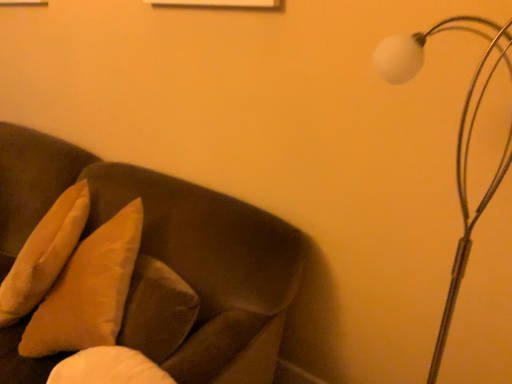
This screenshot has width=512, height=384. Describe the element at coordinates (44, 254) in the screenshot. I see `soft beige pillow at left` at that location.

Where is `soft beige pillow at left`? This screenshot has width=512, height=384. soft beige pillow at left is located at coordinates (44, 254).

Describe the element at coordinates (164, 241) in the screenshot. The image size is (512, 384). I see `suede-like brown couch at left` at that location.

I want to click on soft beige pillow at left, so click(44, 254).

Is suede-like brown couch at left looking in the opposite direction of soft beige pillow at left?

Absolutely, suede-like brown couch at left is directed away from soft beige pillow at left.

Which of these two, suede-like brown couch at left or soft beige pillow at left, is wider?

suede-like brown couch at left.

From a real-world perspective, between suede-like brown couch at left and soft beige pillow at left, who is vertically lower?

suede-like brown couch at left, from a real-world perspective.

Which is correct: suede-like brown couch at left is inside soft beige pillow at left, or outside of it?

suede-like brown couch at left is spatially situated outside soft beige pillow at left.

Looking at this image, would you say suede-like brown couch at left contains white matte lamp at upper right?

No.

From the image's perspective, which one is positioned lower, suede-like brown couch at left or white matte lamp at upper right?

suede-like brown couch at left is shown below in the image.

Who is shorter, suede-like brown couch at left or white matte lamp at upper right?

suede-like brown couch at left.

Is suede-like brown couch at left touching white matte lamp at upper right?

suede-like brown couch at left and white matte lamp at upper right are not in contact.

In the scene shown: Is soft beige pillow at left in front of or behind white matte lamp at upper right in the image?

soft beige pillow at left is positioned farther from the viewer than white matte lamp at upper right.

Does point (81, 229) lie behind point (463, 268)?

That is True.

In the scene shown: Is soft beige pillow at left not within white matte lamp at upper right?

Yes.

Which object is positioned more to the left, soft beige pillow at left or white matte lamp at upper right?

Positioned to the left is soft beige pillow at left.

Does white matte lamp at upper right touch soft beige pillow at left?

No, white matte lamp at upper right is not next to soft beige pillow at left.

How distant is white matte lamp at upper right from soft beige pillow at left?

A distance of 1.21 meters exists between white matte lamp at upper right and soft beige pillow at left.

Is soft beige pillow at left at the back of white matte lamp at upper right?

No, soft beige pillow at left is not at the back of white matte lamp at upper right.

From a real-world perspective, is white matte lamp at upper right beneath soft beige pillow at left?

No, from a real-world perspective, white matte lamp at upper right is not beneath soft beige pillow at left.

Looking at this image, which of these two, white matte lamp at upper right or suede-like brown couch at left, is bigger?

Bigger between the two is suede-like brown couch at left.

Is white matte lamp at upper right facing away from suede-like brown couch at left?

white matte lamp at upper right is not turned away from suede-like brown couch at left.

Which of these two, white matte lamp at upper right or suede-like brown couch at left, stands taller?

Standing taller between the two is white matte lamp at upper right.

Considering the sizes of objects soft beige pillow at left and suede-like brown couch at left in the image provided, who is smaller, soft beige pillow at left or suede-like brown couch at left?

soft beige pillow at left is smaller.

From a real-world perspective, is soft beige pillow at left located beneath suede-like brown couch at left?

No.

Considering the positions of objects soft beige pillow at left and suede-like brown couch at left in the image provided, who is behind, soft beige pillow at left or suede-like brown couch at left?

soft beige pillow at left is further away from the camera.

At what (x,y) coordinates should I click in order to perform the action: click on pillow above the suede-like brown couch at left (from the image's perspective). Please return your answer as a coordinate pair (x, y). Looking at the image, I should click on (44, 254).

Locate an element on the screen. This screenshot has width=512, height=384. lamp in front of the suede-like brown couch at left is located at coordinates (457, 142).

Considering their positions, is suede-like brown couch at left positioned further to soft beige pillow at left than white matte lamp at upper right?

white matte lamp at upper right is further to soft beige pillow at left.

Which object lies nearer to the anchor point white matte lamp at upper right, soft beige pillow at left or suede-like brown couch at left?

suede-like brown couch at left.

Looking at the image, which one is located closer to suede-like brown couch at left, soft beige pillow at left or white matte lamp at upper right?

Based on the image, soft beige pillow at left appears to be nearer to suede-like brown couch at left.

Estimate the real-world distances between objects in this image. Which object is closer to white matte lamp at upper right, suede-like brown couch at left or soft beige pillow at left?

suede-like brown couch at left is positioned closer to the anchor white matte lamp at upper right.

From the image, which object appears to be nearer to soft beige pillow at left, white matte lamp at upper right or suede-like brown couch at left?

suede-like brown couch at left is closer to soft beige pillow at left.

When comparing their distances from suede-like brown couch at left, does white matte lamp at upper right or soft beige pillow at left seem further?

white matte lamp at upper right lies further to suede-like brown couch at left than the other object.

In order to click on pillow situated between suede-like brown couch at left and white matte lamp at upper right from left to right in this screenshot , I will do (44, 254).